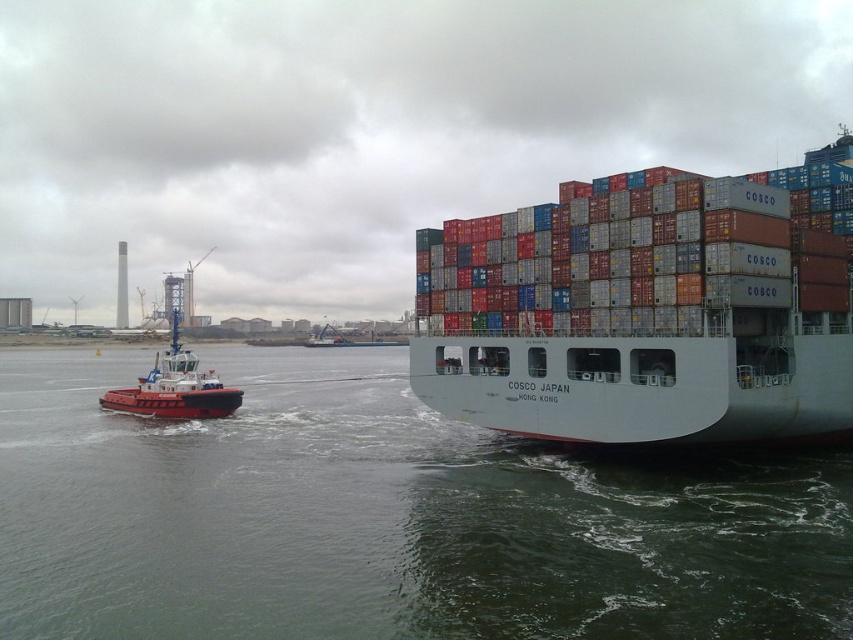
You are a maritime engineer assessing the safety of the tugboat and the waterway. Given that the tugboat must maintain a minimum distance of 20 meters from any obstacle, is the current distance between the clear water at lower left and the red matte tugboat at left compliant with safety regulations?

The distance between the clear water at lower left and the red matte tugboat at left is 19.26 meters, which is less than the required 20 meters. Therefore, the current distance does not comply with safety regulations.

Consider the image. You are standing on the deck of the COSCO JAPAN container ship and want to get to the clear water at lower left. What direction should you walk to reach it?

The clear water at lower left is located at point coordinates, so you should walk towards the lower left direction from your current position on the deck to reach it.

You are a photographer standing on the dock and want to take a photo of the clear water at lower left and the white matte container ship at center. Which object will occupy more space in your photo?

The clear water at lower left is larger in size than the white matte container ship at center, so it will occupy more space in the photo.